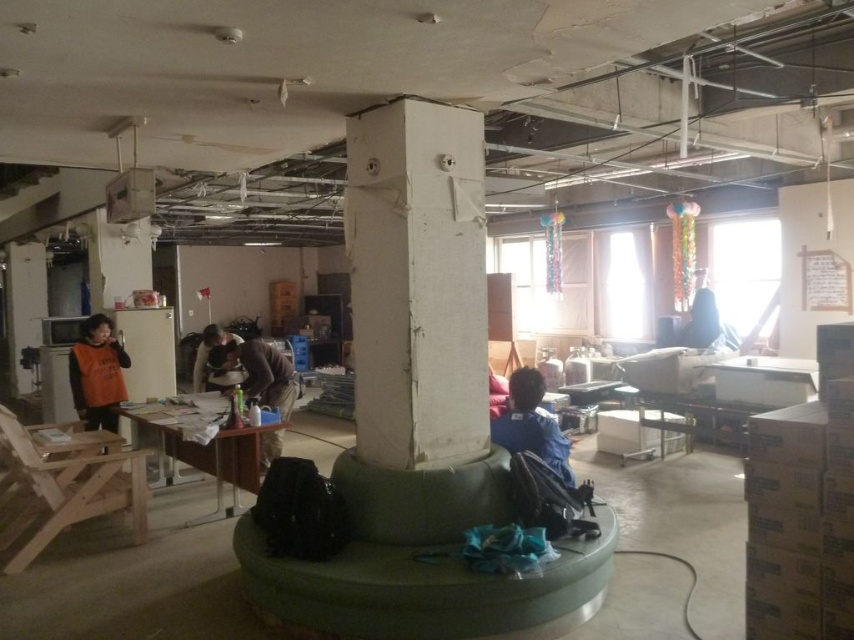
Question: Among these points, which one is farthest from the camera?

Choices:
 (A) click(498, 424)
 (B) click(97, 317)
 (C) click(434, 294)

Answer: (B)

Question: Where is green rubber couch at center located in relation to wooden desk at center in the image?

Choices:
 (A) right
 (B) left

Answer: (A)

Question: From the image, what is the correct spatial relationship of green rubber couch at center in relation to blue fabric at lower right?

Choices:
 (A) below
 (B) above

Answer: (A)

Question: Does orange fabric vest at left have a smaller size compared to dark blue fabric at upper right?

Choices:
 (A) no
 (B) yes

Answer: (A)

Question: Which point is closer to the camera taking this photo?

Choices:
 (A) (85, 401)
 (B) (484, 323)
 (C) (205, 380)

Answer: (B)

Question: Which object is the closest to the orange fabric vest at left?

Choices:
 (A) wooden desk at center
 (B) blue fabric at lower right

Answer: (A)